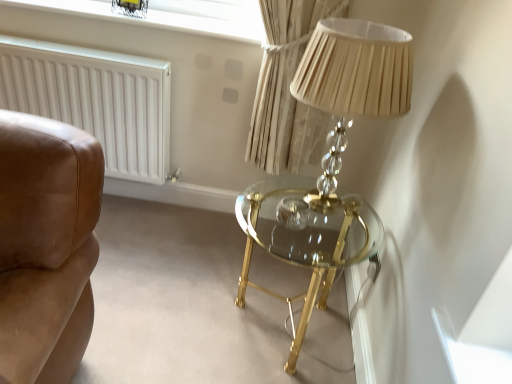
Question: Can you confirm if clear glass window screen at upper center is wider than white matte radiator at left?

Choices:
 (A) yes
 (B) no

Answer: (A)

Question: From the image's perspective, would you say clear glass window screen at upper center is shown under white matte radiator at left?

Choices:
 (A) no
 (B) yes

Answer: (A)

Question: Is clear glass window screen at upper center taller than white matte radiator at left?

Choices:
 (A) yes
 (B) no

Answer: (B)

Question: Does clear glass window screen at upper center have a lesser height compared to white matte radiator at left?

Choices:
 (A) yes
 (B) no

Answer: (A)

Question: Considering the relative sizes of clear glass window screen at upper center and white matte radiator at left in the image provided, is clear glass window screen at upper center bigger than white matte radiator at left?

Choices:
 (A) yes
 (B) no

Answer: (B)

Question: From the image's perspective, relative to white matte radiator at left, is gold glass table at center above or below?

Choices:
 (A) above
 (B) below

Answer: (B)

Question: Based on their positions, is gold glass table at center located to the left or right of white matte radiator at left?

Choices:
 (A) left
 (B) right

Answer: (B)

Question: Do you think gold glass table at center is within white matte radiator at left, or outside of it?

Choices:
 (A) inside
 (B) outside

Answer: (B)

Question: From a real-world perspective, is gold glass table at center physically located above or below white matte radiator at left?

Choices:
 (A) above
 (B) below

Answer: (B)

Question: In the image, is clear glass window screen at upper center positioned in front of or behind white matte radiator at left?

Choices:
 (A) front
 (B) behind

Answer: (B)

Question: Looking at the image, does clear glass window screen at upper center seem bigger or smaller compared to white matte radiator at left?

Choices:
 (A) big
 (B) small

Answer: (B)

Question: Considering the positions of point (87, 4) and point (72, 92), is point (87, 4) closer or farther from the camera than point (72, 92)?

Choices:
 (A) closer
 (B) farther

Answer: (A)

Question: Is clear glass window screen at upper center taller or shorter than white matte radiator at left?

Choices:
 (A) tall
 (B) short

Answer: (B)

Question: Is point (72, 115) positioned closer to the camera than point (342, 210)?

Choices:
 (A) closer
 (B) farther

Answer: (B)

Question: From a real-world perspective, is white matte radiator at left positioned above or below gold glass table at center?

Choices:
 (A) above
 (B) below

Answer: (A)